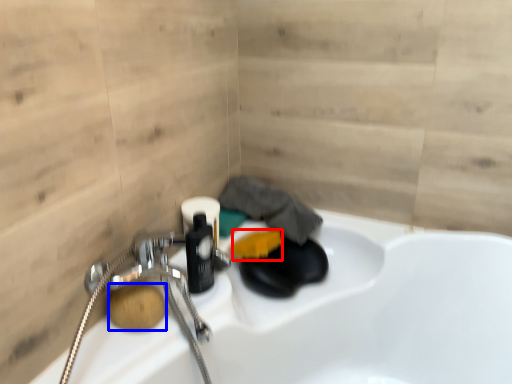
Question: Which point is closer to the camera, soap (highlighted by a red box) or soap (highlighted by a blue box)?

Choices:
 (A) soap
 (B) soap

Answer: (B)